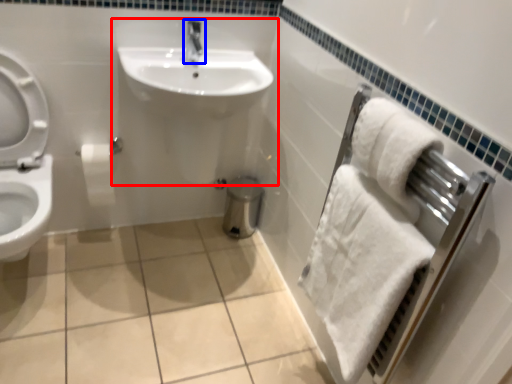
Question: Which point is closer to the camera, sink (highlighted by a red box) or tap (highlighted by a blue box)?

Choices:
 (A) sink
 (B) tap

Answer: (A)